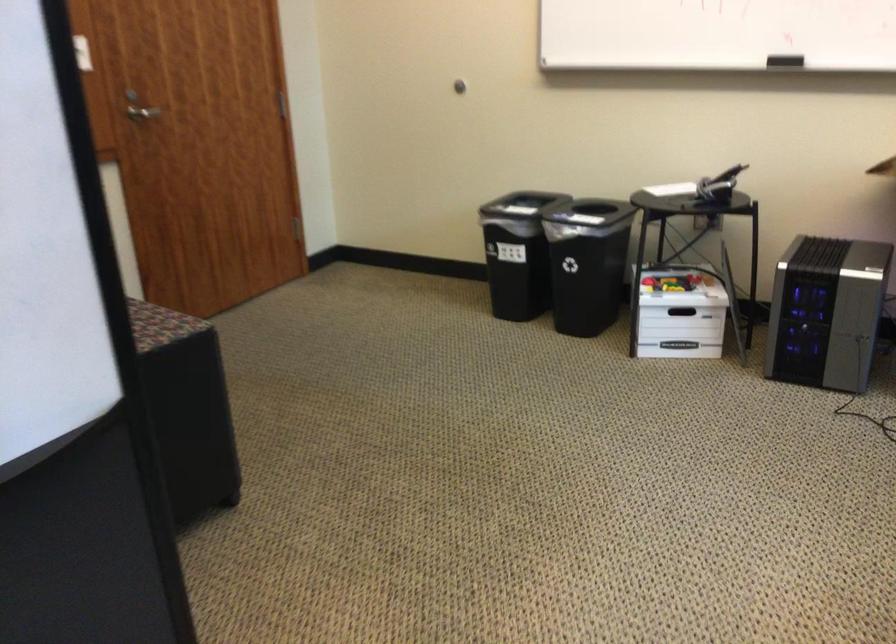
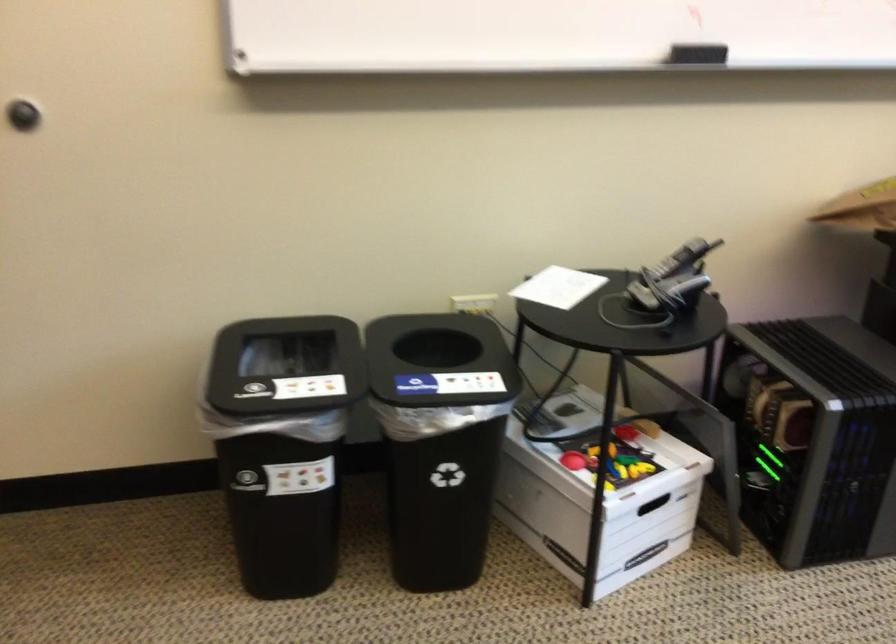
In the second image, find the point that corresponds to [638,295] in the first image.

(599, 495)